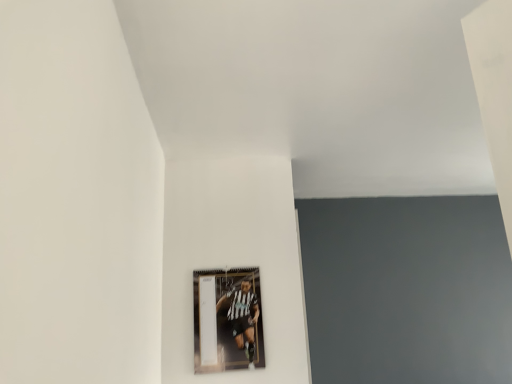
Describe the element at coordinates (227, 320) in the screenshot. I see `metallic silver picture frame at center` at that location.

What are the coordinates of `metallic silver picture frame at center` in the screenshot? It's located at (227, 320).

Identify the location of metallic silver picture frame at center. Image resolution: width=512 pixels, height=384 pixels. (227, 320).